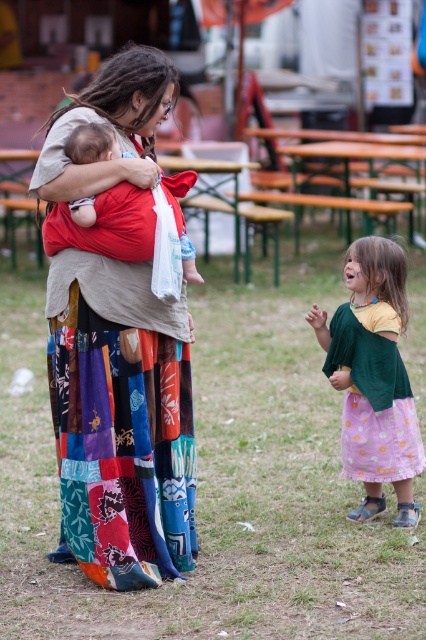
Does point (367, 248) lie in front of point (92, 141)?

That is False.

Does pastel floral dress at lower right appear on the left side of matte red baby carrier at center?

Incorrect, pastel floral dress at lower right is not on the left side of matte red baby carrier at center.

Locate an element on the screen. The image size is (426, 640). pastel floral dress at lower right is located at coordinates (374, 378).

Where is `pastel floral dress at lower right`? pastel floral dress at lower right is located at coordinates (374, 378).

How distant is patchwork fabric skirt at center from matte red baby carrier at center?

patchwork fabric skirt at center is 3.85 feet away from matte red baby carrier at center.

Is point (169, 483) positioned behind point (103, 148)?

Yes, it is.

Which is in front, point (55, 413) or point (86, 211)?

Positioned in front is point (86, 211).

In order to click on patchwork fabric skirt at center in this screenshot , I will do `click(121, 448)`.

Is multicolored patchwork skirt at center positioned behind pastel floral dress at lower right?

No, multicolored patchwork skirt at center is in front of pastel floral dress at lower right.

How distant is multicolored patchwork skirt at center from pastel floral dress at lower right?

multicolored patchwork skirt at center and pastel floral dress at lower right are 1.09 meters apart from each other.

This screenshot has width=426, height=640. In order to click on multicolored patchwork skirt at center in this screenshot , I will do `click(120, 419)`.